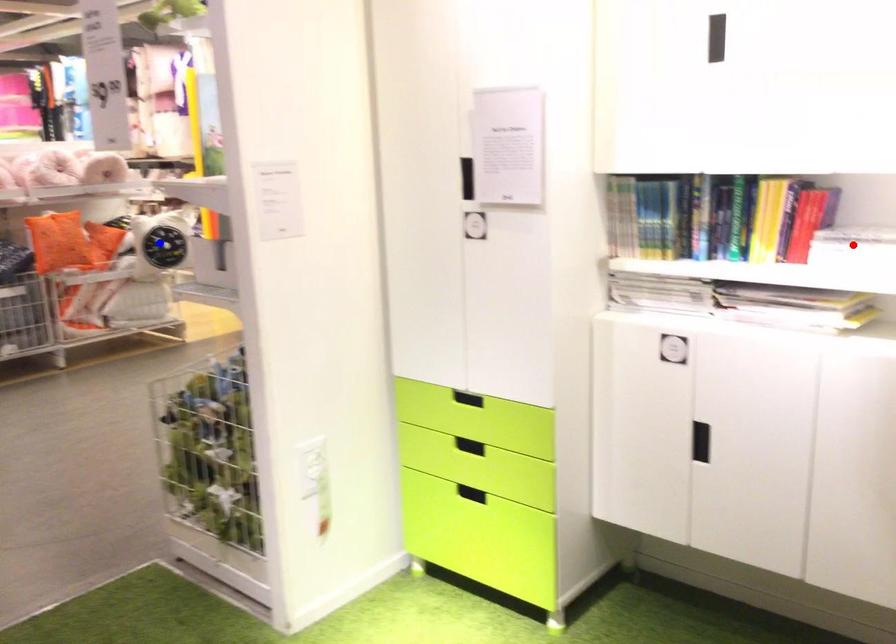
Question: Two points are marked on the image. Which point is closer to the camera?

Choices:
 (A) Blue point is closer.
 (B) Red point is closer.

Answer: (B)